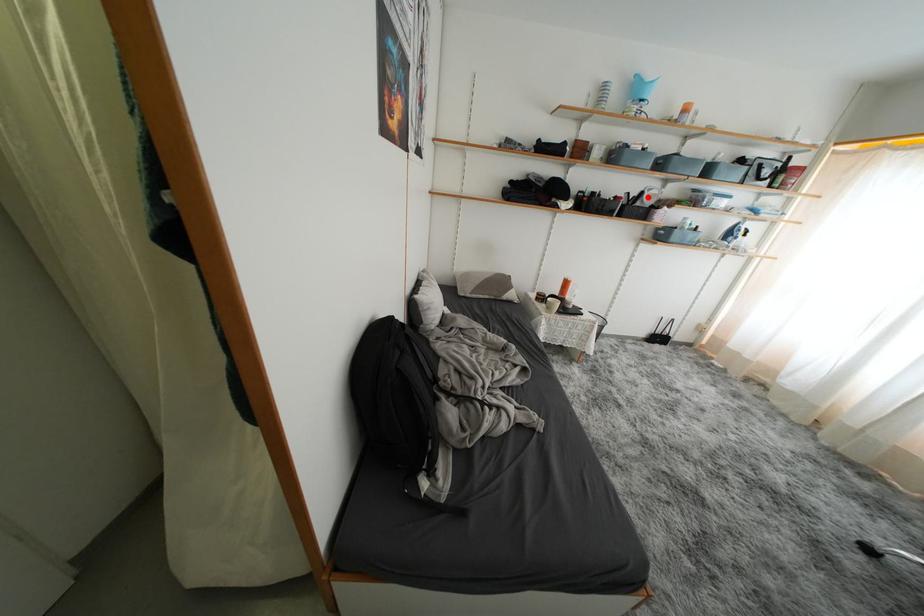
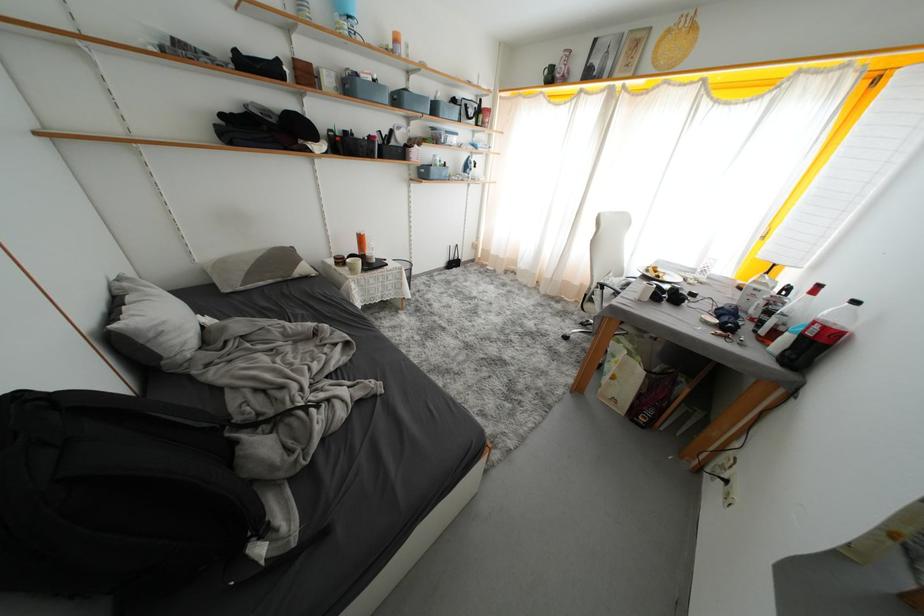
Where in the second image is the point corresponding to the highlighted location from the first image?

(397, 136)